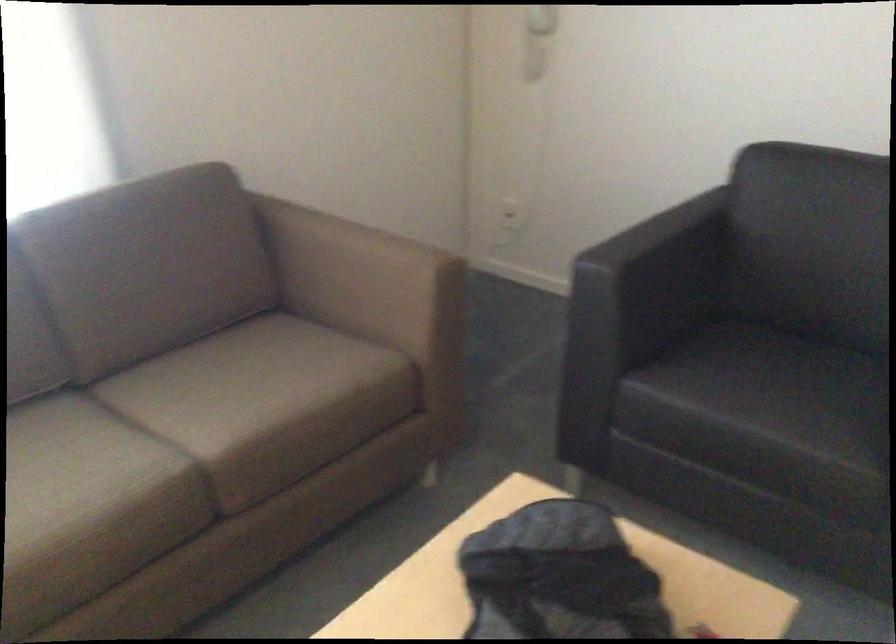
What do you see at coordinates (765, 397) in the screenshot? I see `a black sofa sitting surface` at bounding box center [765, 397].